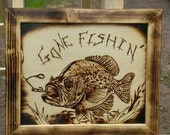
Identify the location of frame. Image resolution: width=170 pixels, height=135 pixels. (131, 16), (11, 127), (109, 126).